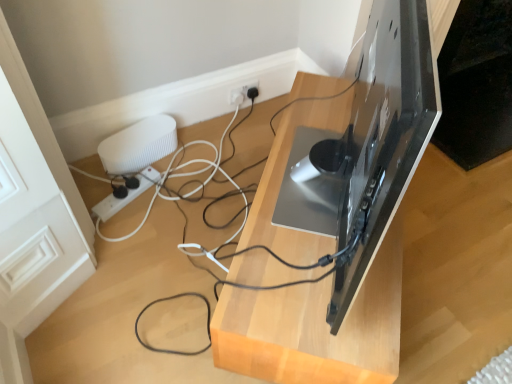
This screenshot has width=512, height=384. What are the coordinates of `free space between matte black tv stand at center and white ribbed speaker at left` in the screenshot? It's located at (196, 210).